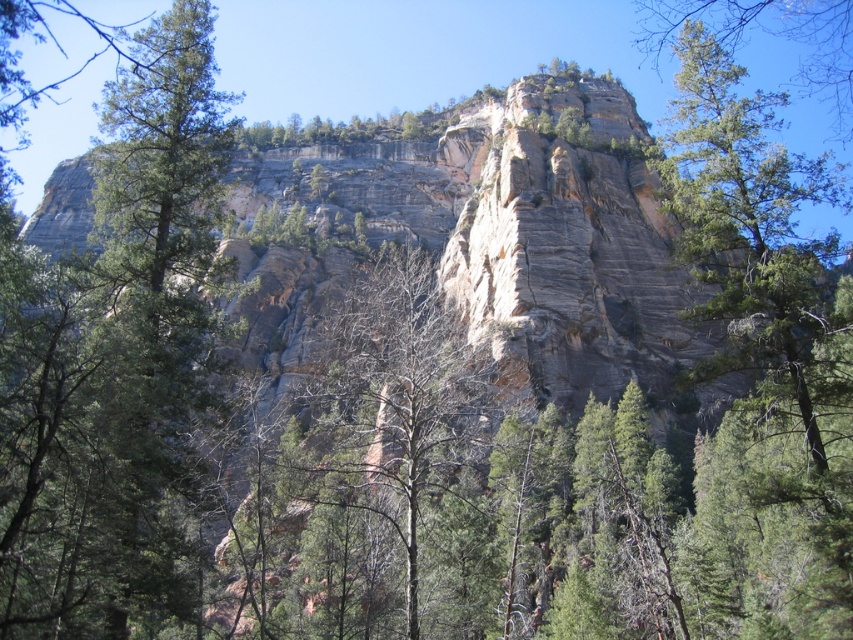
Does bare branches at center come in front of green textured tree at upper right?

That is True.

Can you confirm if bare branches at center is thinner than green textured tree at upper right?

Yes, bare branches at center is thinner than green textured tree at upper right.

You are a GUI agent. You are given a task and a screenshot of the screen. Output one action in this format:
    pyautogui.click(x=<x>, y=<y>)
    Task: Click on the bare branches at center
    The width and height of the screenshot is (853, 640).
    Given the screenshot: What is the action you would take?
    click(398, 458)

Where is `bare branches at center`? This screenshot has width=853, height=640. bare branches at center is located at coordinates (398, 458).